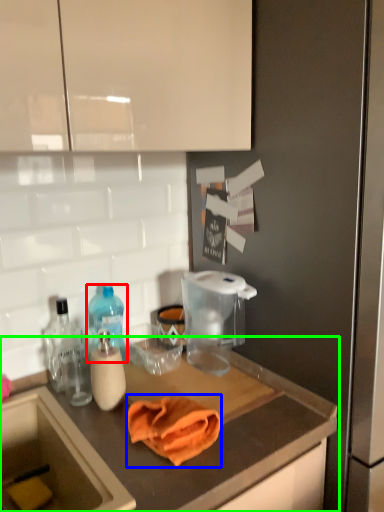
Question: Estimate the real-world distances between objects in this image. Which object is farther from bottle (highlighted by a red box), bath towel (highlighted by a blue box) or countertop (highlighted by a green box)?

Choices:
 (A) bath towel
 (B) countertop

Answer: (B)